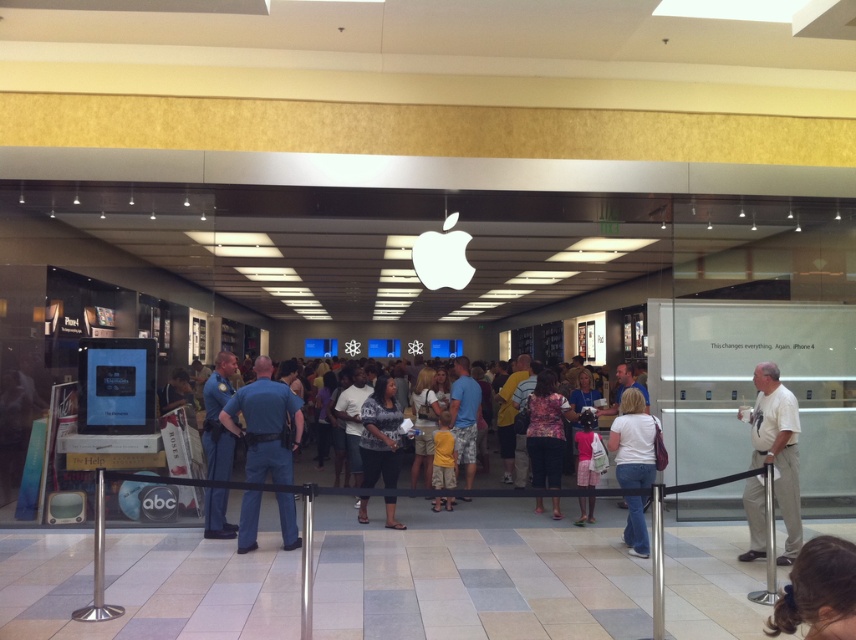
Can you confirm if printed fabric blouse at center is shorter than yellow shorts at center?

In fact, printed fabric blouse at center may be taller than yellow shorts at center.

The height and width of the screenshot is (640, 856). In order to click on printed fabric blouse at center in this screenshot , I will do `click(381, 435)`.

Identify the location of printed fabric blouse at center. (381, 435).

Does blue uniform pants at center have a greater width compared to floral fabric dress at center?

No.

This screenshot has width=856, height=640. What are the coordinates of `blue uniform pants at center` in the screenshot? It's located at (217, 419).

Which is above, printed fabric blouse at center or floral fabric dress at center?

floral fabric dress at center

Is printed fabric blouse at center above floral fabric dress at center?

Actually, printed fabric blouse at center is below floral fabric dress at center.

Does point (391, 454) come farther from viewer compared to point (536, 452)?

That is False.

You are a GUI agent. You are given a task and a screenshot of the screen. Output one action in this format:
    pyautogui.click(x=<x>, y=<y>)
    Task: Click on the printed fabric blouse at center
    This screenshot has width=856, height=640.
    Given the screenshot: What is the action you would take?
    pyautogui.click(x=381, y=435)